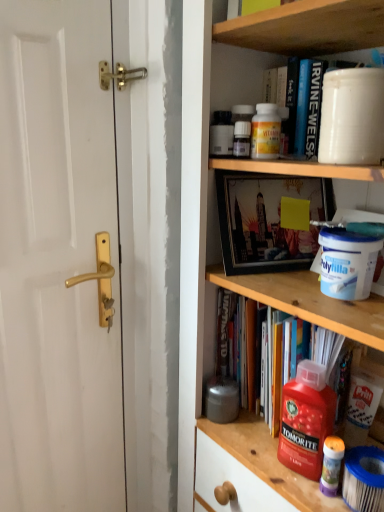
This screenshot has height=512, width=384. Find the location of `red plastic bottle at lower center, marked as the 1th cleaning product in a bottom-to-top arrangement`. red plastic bottle at lower center, marked as the 1th cleaning product in a bottom-to-top arrangement is located at coordinates (306, 420).

Describe the element at coordinates (308, 28) in the screenshot. I see `wooden shelf at upper center, which is the 2th cabinet from bottom to top` at that location.

The image size is (384, 512). Identify the location of hardcover book at center. (340, 350).

The height and width of the screenshot is (512, 384). What do you see at coordinates (238, 75) in the screenshot?
I see `white plastic container at upper center, the first cabinet in the bottom-to-top sequence` at bounding box center [238, 75].

Measure the distance between point [259,125] and camera.

They are 89.90 centimeters apart.

This screenshot has height=512, width=384. What do you see at coordinates (265, 132) in the screenshot?
I see `yellow matte vitamin bottle at upper center, positioned as the 1th cleaning product in top-to-bottom order` at bounding box center [265, 132].

This screenshot has height=512, width=384. Identify the location of red plastic bottle at lower center, marked as the 1th cleaning product in a bottom-to-top arrangement. (306, 420).

Considering their positions, is matte black bottle at upper center located in front of or behind wooden at center?

matte black bottle at upper center is positioned farther from the viewer than wooden at center.

Is matte black bottle at upper center bigger or smaller than wooden at center?

In the image, matte black bottle at upper center appears to be smaller than wooden at center.

How different are the orientations of matte black bottle at upper center and wooden at center in degrees?

They differ by 36.7 degrees in their facing directions.

Is the surface of matte black bottle at upper center in direct contact with wooden at center?

They are not placed beside each other.

How distant is red plastic bottle at lower center, the second cleaning product viewed from the top, from yellow matte vitamin bottle at upper center, arranged as the 2th cleaning product when ordered from the bottom?

red plastic bottle at lower center, the second cleaning product viewed from the top, is 52.52 centimeters from yellow matte vitamin bottle at upper center, arranged as the 2th cleaning product when ordered from the bottom.

Do you think red plastic bottle at lower center, the second cleaning product viewed from the top, is within yellow matte vitamin bottle at upper center, arranged as the 2th cleaning product when ordered from the bottom, or outside of it?

red plastic bottle at lower center, the second cleaning product viewed from the top, cannot be found inside yellow matte vitamin bottle at upper center, arranged as the 2th cleaning product when ordered from the bottom.

Does point (323, 401) lie in front of point (271, 122)?

Yes, it is.

This screenshot has width=384, height=512. I want to click on cleaning product lying on the right of yellow matte vitamin bottle at upper center, positioned as the 1th cleaning product in top-to-bottom order, so (306, 420).

From the image's perspective, which one is positioned higher, white glossy door handle at left or wooden shelf at upper center, which is the first cabinet from top to bottom?

wooden shelf at upper center, which is the first cabinet from top to bottom, appears higher in the image.

Considering the positions of points (94, 15) and (303, 48), is point (94, 15) farther from camera compared to point (303, 48)?

No, (94, 15) is closer to viewer.

Is white glossy door handle at left smaller than wooden shelf at upper center, which is the first cabinet from top to bottom?

No.

Is white glossy door handle at left to the left or to the right of wooden shelf at upper center, which is the first cabinet from top to bottom, in the image?

Clearly, white glossy door handle at left is on the left of wooden shelf at upper center, which is the first cabinet from top to bottom, in the image.

From a real-world perspective, between yellow matte vitamin bottle at upper center, positioned as the 1th cleaning product in top-to-bottom order, and wooden at center, who is vertically lower?

wooden at center, from a real-world perspective.

Considering the sizes of yellow matte vitamin bottle at upper center, positioned as the 1th cleaning product in top-to-bottom order, and wooden at center in the image, is yellow matte vitamin bottle at upper center, positioned as the 1th cleaning product in top-to-bottom order, wider or thinner than wooden at center?

yellow matte vitamin bottle at upper center, positioned as the 1th cleaning product in top-to-bottom order, is thinner than wooden at center.

Is yellow matte vitamin bottle at upper center, arranged as the 2th cleaning product when ordered from the bottom, not near wooden at center?

No, there isn't a large distance between yellow matte vitamin bottle at upper center, arranged as the 2th cleaning product when ordered from the bottom, and wooden at center.

From a real-world perspective, is white glossy door handle at left located beneath wooden at center?

No, from a real-world perspective, white glossy door handle at left is not below wooden at center.

Relative to wooden at center, is white glossy door handle at left in front or behind?

In the image, white glossy door handle at left appears behind wooden at center.

How different are the orientations of white glossy door handle at left and wooden at center in degrees?

88.9 degrees separate the facing orientations of white glossy door handle at left and wooden at center.

Is white glossy door handle at left positioned beyond the bounds of white plastic container at upper center, the first cabinet in the bottom-to-top sequence?

Yes, white glossy door handle at left is not within white plastic container at upper center, the first cabinet in the bottom-to-top sequence.

From a real-world perspective, is white glossy door handle at left below white plastic container at upper center, the second cabinet in the top-to-bottom sequence?

Yes, from a real-world perspective, white glossy door handle at left is below white plastic container at upper center, the second cabinet in the top-to-bottom sequence.

In order to click on cabinet that is in front of the hardcover book at center in this screenshot , I will do `click(308, 28)`.

Is hardcover book at center placed right next to wooden shelf at upper center, which is the 2th cabinet from bottom to top?

No, hardcover book at center is not next to wooden shelf at upper center, which is the 2th cabinet from bottom to top.

Would you say hardcover book at center contains wooden shelf at upper center, which is the 2th cabinet from bottom to top?

Definitely not — wooden shelf at upper center, which is the 2th cabinet from bottom to top, is not inside hardcover book at center.

Does point (366, 357) lie in front of point (269, 12)?

No.

The width and height of the screenshot is (384, 512). Find the location of `bottle above the wooden at center (from a real-world perspective)`. bottle above the wooden at center (from a real-world perspective) is located at coordinates point(221,134).

I want to click on cleaning product located below the yellow matte vitamin bottle at upper center, arranged as the 2th cleaning product when ordered from the bottom (from the image's perspective), so click(306, 420).

From the picture: Looking at the image, which one is located closer to white glossy door handle at left, matte black bottle at upper center or red plastic bottle at lower center, marked as the 1th cleaning product in a bottom-to-top arrangement?

matte black bottle at upper center lies closer to white glossy door handle at left than the other object.

Which object lies nearer to the anchor point red plastic bottle at lower center, marked as the 1th cleaning product in a bottom-to-top arrangement, white glossy door handle at left or matte black bottle at upper center?

Based on the image, matte black bottle at upper center appears to be nearer to red plastic bottle at lower center, marked as the 1th cleaning product in a bottom-to-top arrangement.

Looking at the image, which one is located closer to wooden shelf at upper center, which is the 2th cabinet from bottom to top, matte black bottle at upper center or red plastic bottle at lower center, marked as the 1th cleaning product in a bottom-to-top arrangement?

The object closer to wooden shelf at upper center, which is the 2th cabinet from bottom to top, is matte black bottle at upper center.

Consider the image. From the image, which object appears to be nearer to white glossy door handle at left, yellow matte vitamin bottle at upper center, positioned as the 1th cleaning product in top-to-bottom order, or hardcover book at center?

The object closer to white glossy door handle at left is hardcover book at center.

Based on their spatial positions, is hardcover book at center or wooden at center further from red plastic bottle at lower center, marked as the 1th cleaning product in a bottom-to-top arrangement?

wooden at center is further to red plastic bottle at lower center, marked as the 1th cleaning product in a bottom-to-top arrangement.

Based on their spatial positions, is hardcover book at center or white glossy door handle at left closer to white plastic container at upper center, the second cabinet in the top-to-bottom sequence?

hardcover book at center is positioned closer to the anchor white plastic container at upper center, the second cabinet in the top-to-bottom sequence.

Estimate the real-world distances between objects in this image. Which object is closer to wooden at center, hardcover book at center or yellow matte vitamin bottle at upper center, arranged as the 2th cleaning product when ordered from the bottom?

The object closer to wooden at center is yellow matte vitamin bottle at upper center, arranged as the 2th cleaning product when ordered from the bottom.

Based on their spatial positions, is white glossy door handle at left or wooden at center further from wooden shelf at upper center, which is the 2th cabinet from bottom to top?

white glossy door handle at left lies further to wooden shelf at upper center, which is the 2th cabinet from bottom to top, than the other object.

Find the location of a particular element. The image size is (384, 512). door between wooden shelf at upper center, which is the first cabinet from top to bottom, and hardcover book at center in the up-down direction is located at coordinates (58, 261).

This screenshot has height=512, width=384. Identify the location of cabinet that lies between wooden shelf at upper center, which is the first cabinet from top to bottom, and red plastic bottle at lower center, the second cleaning product viewed from the top, from top to bottom. [238, 75].

Image resolution: width=384 pixels, height=512 pixels. Identify the location of shelf between matte black bottle at upper center and hardcover book at center from top to bottom. (193, 229).

In order to click on cleaning product between wooden shelf at upper center, which is the first cabinet from top to bottom, and white glossy door handle at left from top to bottom in this screenshot , I will do `click(265, 132)`.